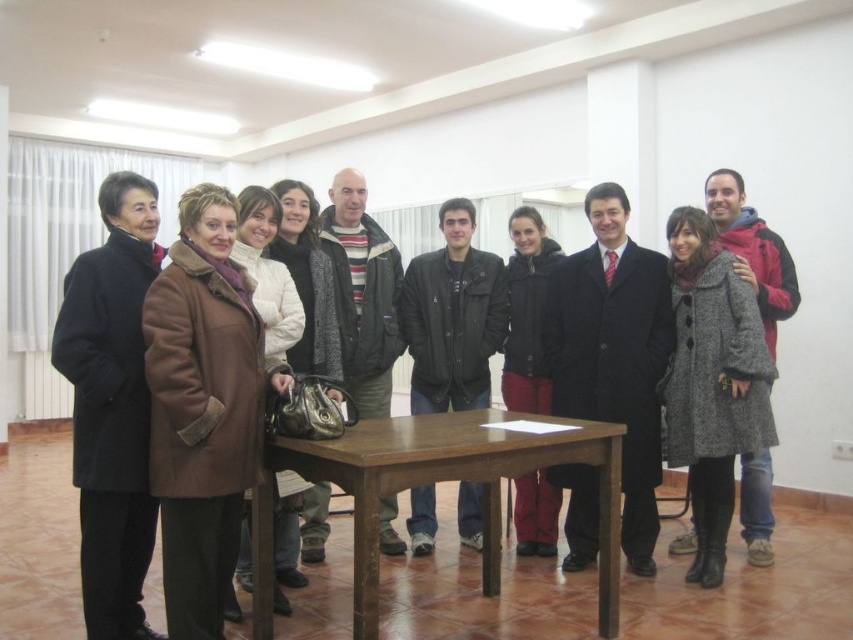
Does gray wool coat at center appear under striped wool sweater at center?

Yes.

Locate an element on the screen. gray wool coat at center is located at coordinates (712, 381).

Between point (735, 396) and point (354, 268), which one is positioned behind?

Positioned behind is point (354, 268).

At what (x,y) coordinates should I click in order to perform the action: click on gray wool coat at center. Please return your answer as a coordinate pair (x, y). Image resolution: width=853 pixels, height=640 pixels. Looking at the image, I should click on (712, 381).

From the picture: Is wooden table at center smaller than dark gray leather jacket at center?

No.

Which is above, wooden table at center or dark gray leather jacket at center?

dark gray leather jacket at center is higher up.

Where is `wooden table at center`? Image resolution: width=853 pixels, height=640 pixels. wooden table at center is located at coordinates (456, 480).

Does brown woolen coat at left lie in front of brown fuzzy coat at center?

Yes, it is.

Who is more distant from viewer, (187, 508) or (276, 573)?

Positioned behind is point (276, 573).

Which is in front, point (192, 237) or point (279, 476)?

Point (192, 237) is in front.

This screenshot has width=853, height=640. I want to click on brown woolen coat at left, so click(x=202, y=408).